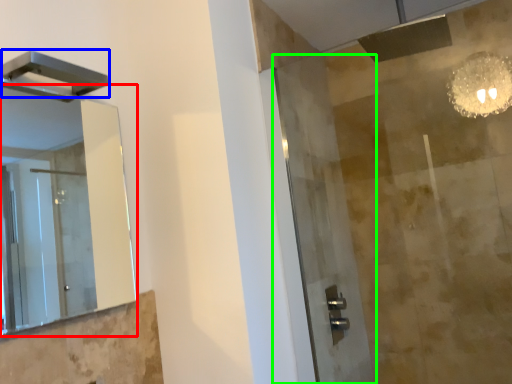
Question: Considering the real-world distances, which object is farthest from mirror (highlighted by a red box)? shower (highlighted by a blue box) or screen door (highlighted by a green box)?

Choices:
 (A) shower
 (B) screen door

Answer: (A)